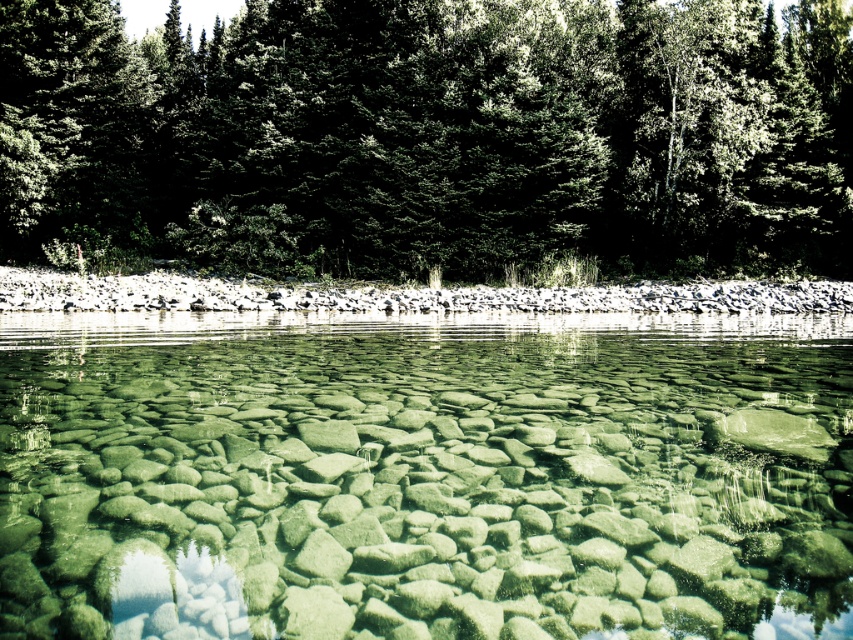
How far apart are green stone river at center and green textured trees at upper center?

They are 109.03 feet apart.

The height and width of the screenshot is (640, 853). What do you see at coordinates (426, 481) in the screenshot?
I see `green stone river at center` at bounding box center [426, 481].

Where is `green stone river at center`? The height and width of the screenshot is (640, 853). green stone river at center is located at coordinates (426, 481).